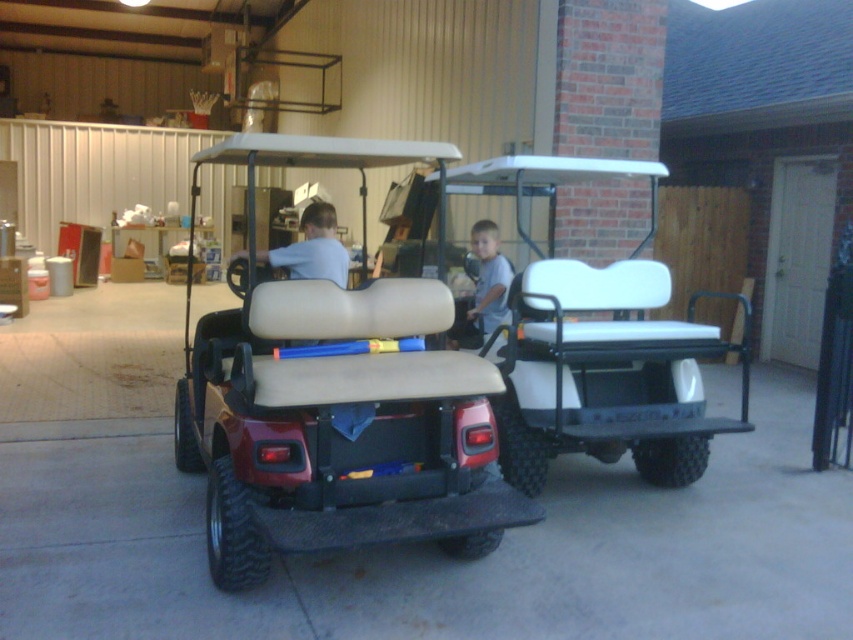
Is beige leather golf cart at center to the right of gray matte shirt at center from the viewer's perspective?

Incorrect, beige leather golf cart at center is not on the right side of gray matte shirt at center.

Does beige leather golf cart at center come behind gray matte shirt at center?

No.

Image resolution: width=853 pixels, height=640 pixels. In order to click on beige leather golf cart at center in this screenshot , I will do `click(338, 428)`.

Image resolution: width=853 pixels, height=640 pixels. What are the coordinates of `beige leather golf cart at center` in the screenshot? It's located at (338, 428).

Does point (412, 465) come in front of point (338, 240)?

Yes.

The image size is (853, 640). What are the coordinates of `beige leather golf cart at center` in the screenshot? It's located at (338, 428).

Measure the distance between beige leather golf cart at center and camera.

beige leather golf cart at center is 9.56 feet away from camera.

Locate an element on the screen. The width and height of the screenshot is (853, 640). beige leather golf cart at center is located at coordinates (338, 428).

Is white matte golf cart at center taller than matte white shirt at center?

Indeed, white matte golf cart at center has a greater height compared to matte white shirt at center.

Does white matte golf cart at center appear on the left side of matte white shirt at center?

In fact, white matte golf cart at center is to the right of matte white shirt at center.

Who is more forward, (x=511, y=172) or (x=335, y=262)?

Point (x=511, y=172) is in front.

Where is `white matte golf cart at center`? The height and width of the screenshot is (640, 853). white matte golf cart at center is located at coordinates (596, 346).